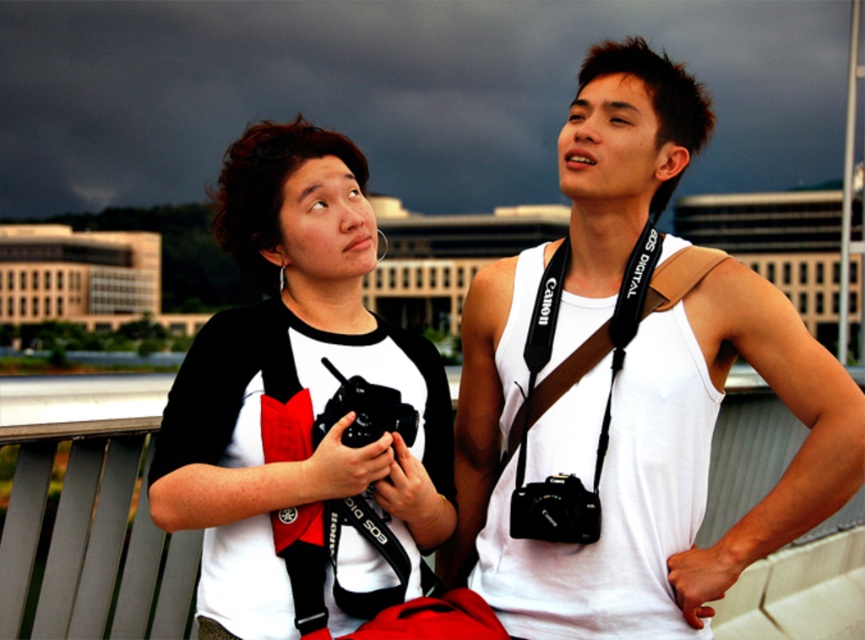
Who is taller, black plastic camera at center or black rubber camera at center?

Standing taller between the two is black rubber camera at center.

Between point (532, 513) and point (334, 376), which one is positioned behind?

Positioned behind is point (532, 513).

This screenshot has width=865, height=640. Find the location of `black plastic camera at center`. black plastic camera at center is located at coordinates (554, 509).

Is white matte/black raglan shirt at upper left above black plastic camera at center?

Indeed, white matte/black raglan shirt at upper left is positioned over black plastic camera at center.

Which is behind, point (396, 387) or point (554, 538)?

Point (554, 538)

Find the location of `white matte/black raglan shirt at upper left`. white matte/black raglan shirt at upper left is located at coordinates (293, 381).

Does point (347, 532) lie in front of point (346, 412)?

Yes, point (347, 532) is in front of point (346, 412).

The image size is (865, 640). Identify the location of white matte/black raglan shirt at upper left. (293, 381).